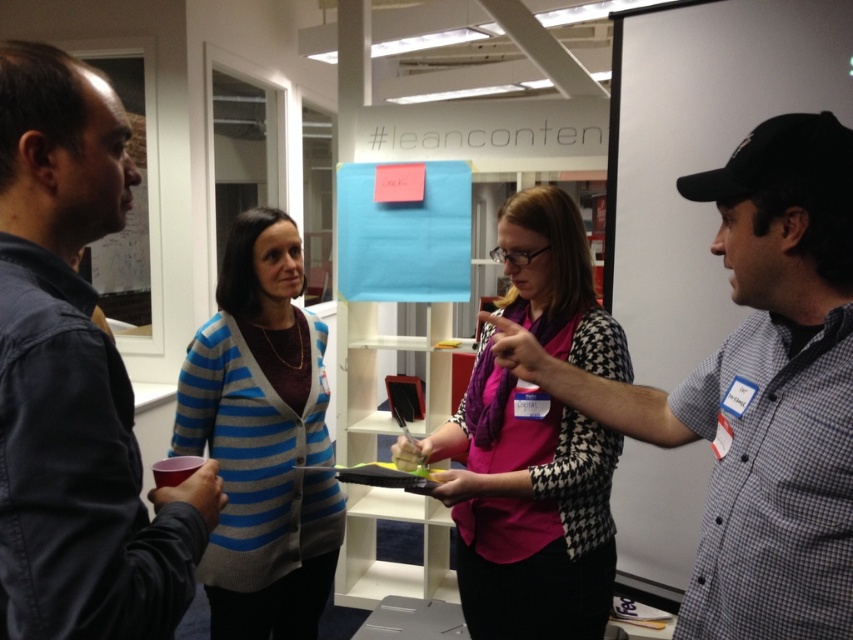
Can you confirm if checkered shirt at center is shorter than pink fabric scarf at center?

Answer: Correct, checkered shirt at center is not as tall as pink fabric scarf at center.

Between point (621, 392) and point (598, 515), which one is positioned behind?

Positioned behind is point (598, 515).

Locate an element on the screen. checkered shirt at center is located at coordinates (757, 392).

Is dark blue denim jacket at left shorter than blue striped cardigan at center?

Indeed, dark blue denim jacket at left has a lesser height compared to blue striped cardigan at center.

Can you confirm if dark blue denim jacket at left is taller than blue striped cardigan at center?

Incorrect, dark blue denim jacket at left's height is not larger of blue striped cardigan at center's.

Who is more forward, (33, 116) or (259, 481)?

Point (33, 116) is more forward.

You are a GUI agent. You are given a task and a screenshot of the screen. Output one action in this format:
    pyautogui.click(x=<x>, y=<y>)
    Task: Click on the dark blue denim jacket at left
    The height and width of the screenshot is (640, 853).
    Given the screenshot: What is the action you would take?
    pyautogui.click(x=74, y=380)

Is dark blue denim jacket at left behind pink fabric scarf at center?

No, dark blue denim jacket at left is in front of pink fabric scarf at center.

Does dark blue denim jacket at left appear under pink fabric scarf at center?

No, dark blue denim jacket at left is not below pink fabric scarf at center.

Who is more forward, (6, 547) or (575, 412)?

Positioned in front is point (6, 547).

Where is `dark blue denim jacket at left`? The width and height of the screenshot is (853, 640). dark blue denim jacket at left is located at coordinates (74, 380).